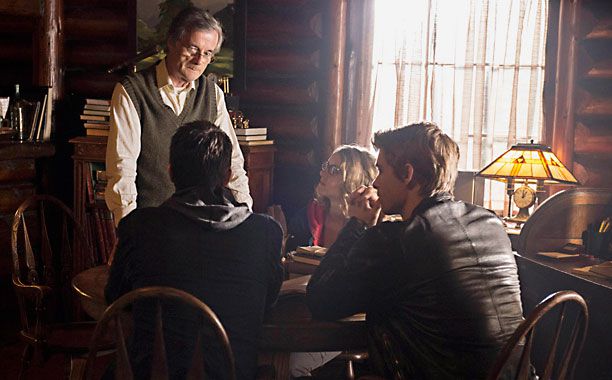
Locate an element on the screen. The width and height of the screenshot is (612, 380). table is located at coordinates (293, 306).